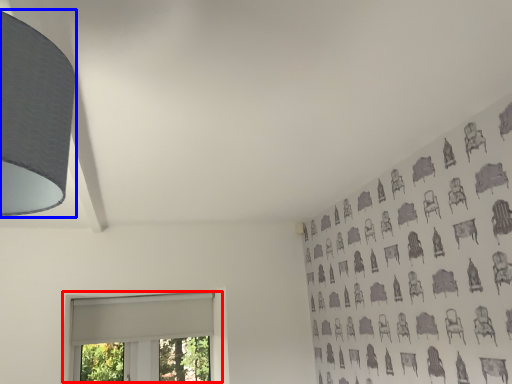
Question: Which object appears farthest to the camera in this image, window (highlighted by a red box) or lamp (highlighted by a blue box)?

Choices:
 (A) window
 (B) lamp

Answer: (A)